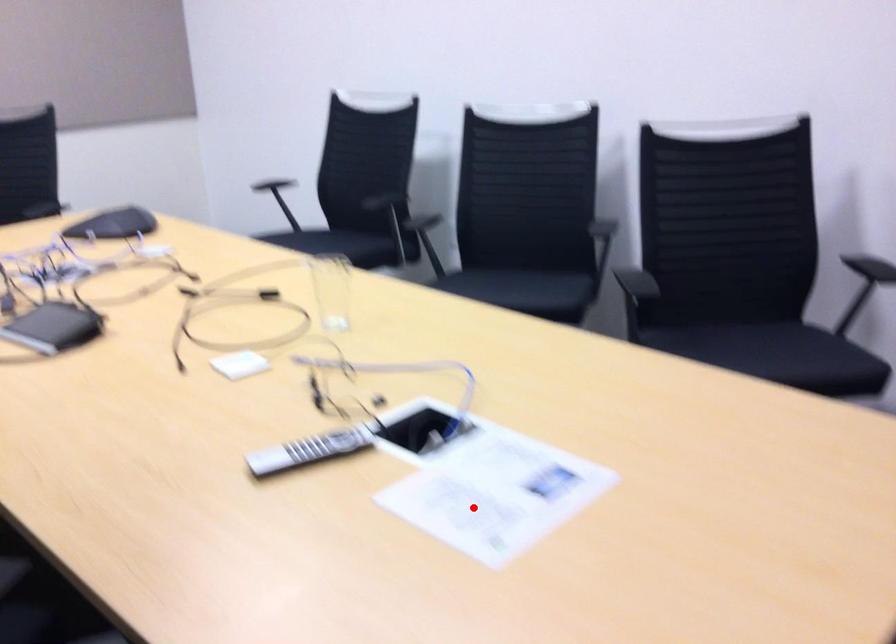
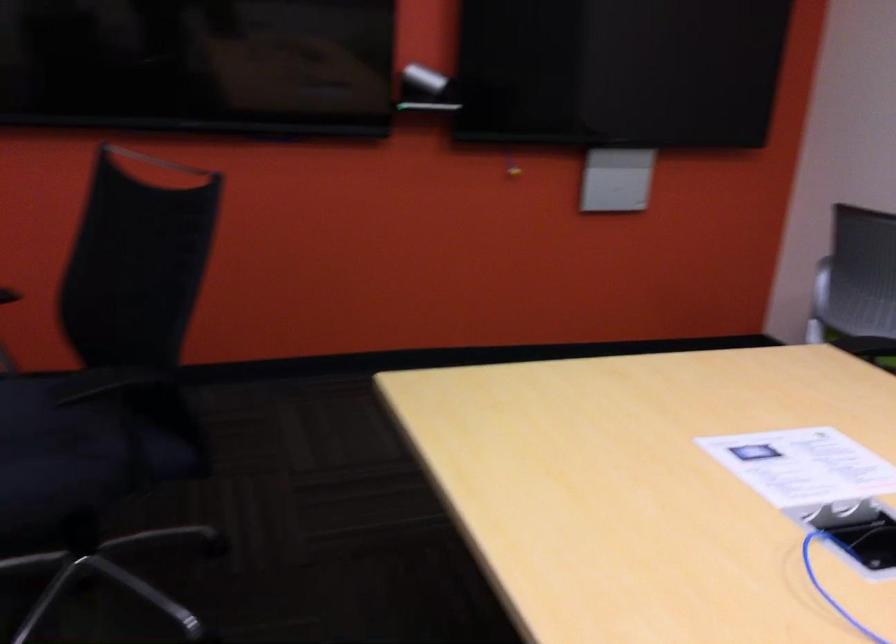
Question: I am providing you with two images of the same scene from different viewpoints. Image1 has a red point marked. In image2, the corresponding 3D location appears at what relative position? Reply with the corresponding letter.

Choices:
 (A) Closer
 (B) Farther

Answer: (B)